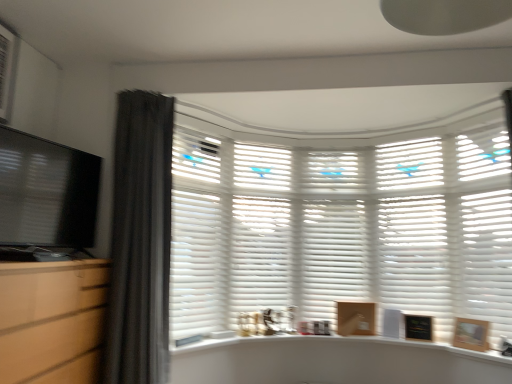
Question: Is wooden picture frame at lower right, the first picture frame viewed from the front, facing away from white matte counter top at center?

Choices:
 (A) yes
 (B) no

Answer: (B)

Question: Does wooden picture frame at lower right, the first picture frame viewed from the front, have a lesser height compared to white matte counter top at center?

Choices:
 (A) yes
 (B) no

Answer: (B)

Question: Can you confirm if wooden picture frame at lower right, which is the 2th picture frame in left-to-right order, is bigger than white matte counter top at center?

Choices:
 (A) no
 (B) yes

Answer: (A)

Question: Is wooden picture frame at lower right, which ranks as the 1th picture frame in right-to-left order, taller than white matte counter top at center?

Choices:
 (A) yes
 (B) no

Answer: (A)

Question: From the image's perspective, is wooden picture frame at lower right, which ranks as the 1th picture frame in right-to-left order, located above white matte counter top at center?

Choices:
 (A) yes
 (B) no

Answer: (A)

Question: Is dark gray fabric curtain at left taller or shorter than white matte shutter at right, which is the first shutter in right-to-left order?

Choices:
 (A) short
 (B) tall

Answer: (B)

Question: Considering the positions of dark gray fabric curtain at left and white matte shutter at right, the 5th shutter when ordered from left to right, in the image, is dark gray fabric curtain at left bigger or smaller than white matte shutter at right, the 5th shutter when ordered from left to right,?

Choices:
 (A) small
 (B) big

Answer: (B)

Question: Considering the positions of point (148, 271) and point (464, 160), is point (148, 271) closer or farther from the camera than point (464, 160)?

Choices:
 (A) farther
 (B) closer

Answer: (B)

Question: From a real-world perspective, is dark gray fabric curtain at left positioned above or below white matte shutter at right, the 5th shutter when ordered from left to right?

Choices:
 (A) below
 (B) above

Answer: (A)

Question: Considering the positions of black matte picture frame at lower right, acting as the 1th picture frame starting from the back, and matte black monitor at left in the image, is black matte picture frame at lower right, acting as the 1th picture frame starting from the back, bigger or smaller than matte black monitor at left?

Choices:
 (A) big
 (B) small

Answer: (B)

Question: Does point (410, 316) appear closer or farther from the camera than point (5, 226)?

Choices:
 (A) closer
 (B) farther

Answer: (B)

Question: From a real-world perspective, is black matte picture frame at lower right, acting as the 1th picture frame starting from the back, positioned above or below matte black monitor at left?

Choices:
 (A) above
 (B) below

Answer: (B)

Question: From their relative heights in the image, would you say black matte picture frame at lower right, acting as the 2th picture frame starting from the right, is taller or shorter than matte black monitor at left?

Choices:
 (A) tall
 (B) short

Answer: (B)

Question: From the image's perspective, is white matte shutter at right, the 5th shutter when ordered from left to right, positioned above or below wooden picture frame at lower right, which ranks as the 1th picture frame in right-to-left order?

Choices:
 (A) below
 (B) above

Answer: (B)

Question: Considering the positions of white matte shutter at right, the 5th shutter when ordered from left to right, and wooden picture frame at lower right, which ranks as the 1th picture frame in right-to-left order, in the image, is white matte shutter at right, the 5th shutter when ordered from left to right, wider or thinner than wooden picture frame at lower right, which ranks as the 1th picture frame in right-to-left order,?

Choices:
 (A) wide
 (B) thin

Answer: (A)